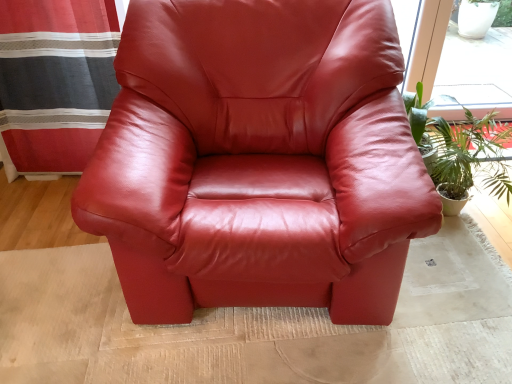
Question: From a real-world perspective, is satin red armchair at center physically located above or below green leafy plant at right?

Choices:
 (A) above
 (B) below

Answer: (A)

Question: Do you think satin red armchair at center is within green leafy plant at right, or outside of it?

Choices:
 (A) inside
 (B) outside

Answer: (B)

Question: Based on their relative distances, which object is nearer to the green leafy plant at right?

Choices:
 (A) satin red armchair at center
 (B) striped fabric curtain at left

Answer: (A)

Question: Which of these objects is positioned closest to the striped fabric curtain at left?

Choices:
 (A) satin red armchair at center
 (B) green leafy plant at right

Answer: (A)